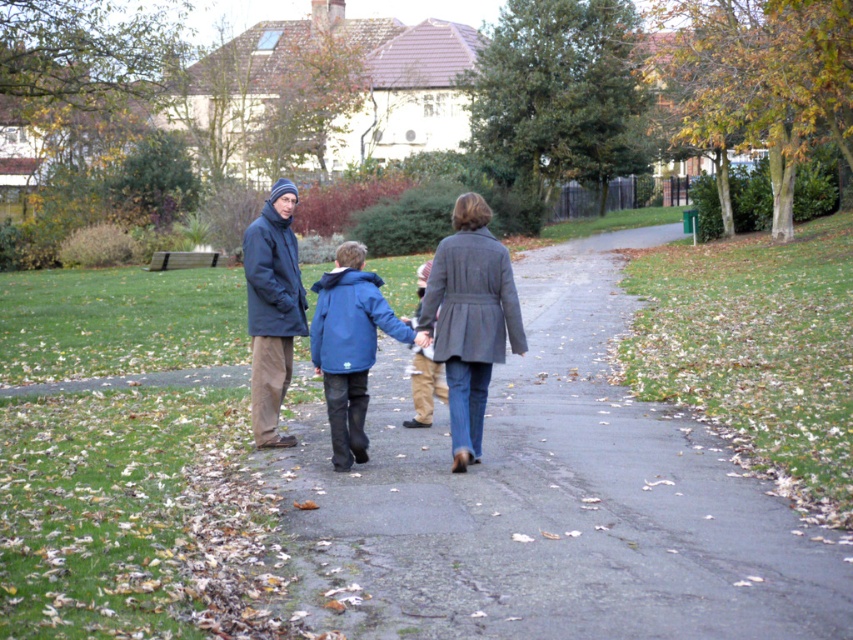
Question: Which point is closer to the camera?

Choices:
 (A) matte blue coat at center
 (B) matte dark blue coat at left
 (C) gray asphalt pavement at center
 (D) blue matte jacket at center

Answer: (C)

Question: Which point is farther to the camera?

Choices:
 (A) khaki cotton pants at center
 (B) gray wool coat at center
 (C) blue matte jacket at center

Answer: (A)

Question: Estimate the real-world distances between objects in this image. Which object is farther from the matte blue coat at center?

Choices:
 (A) khaki cotton pants at center
 (B) gray wool coat at center
 (C) matte dark blue coat at left
 (D) blue matte jacket at center

Answer: (A)

Question: Does gray wool coat at center have a greater width compared to matte blue coat at center?

Choices:
 (A) yes
 (B) no

Answer: (A)

Question: Does gray asphalt pavement at center lie in front of blue matte jacket at center?

Choices:
 (A) no
 (B) yes

Answer: (B)

Question: Considering the relative positions of gray asphalt pavement at center and gray wool coat at center in the image provided, where is gray asphalt pavement at center located with respect to gray wool coat at center?

Choices:
 (A) left
 (B) right

Answer: (B)